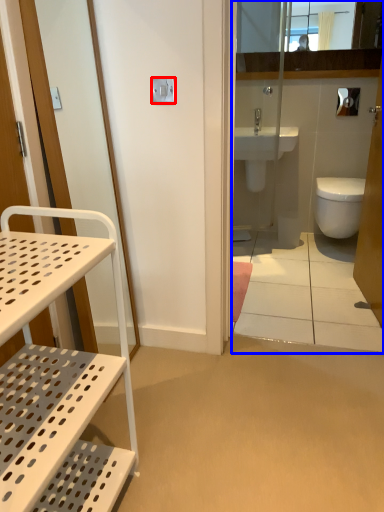
Question: Which point is closer to the camera, lock (highlighted by a red box) or corridor (highlighted by a blue box)?

Choices:
 (A) lock
 (B) corridor

Answer: (B)